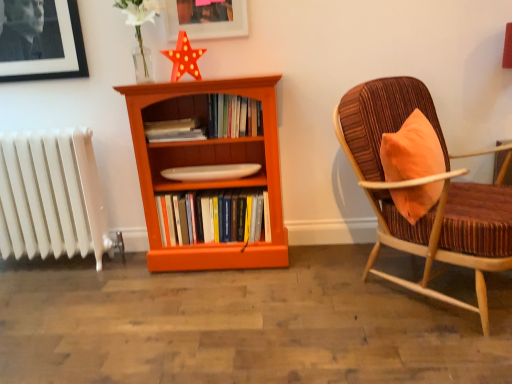
Identify the location of unoccupied region to the right of white painted radiator at left. (117, 280).